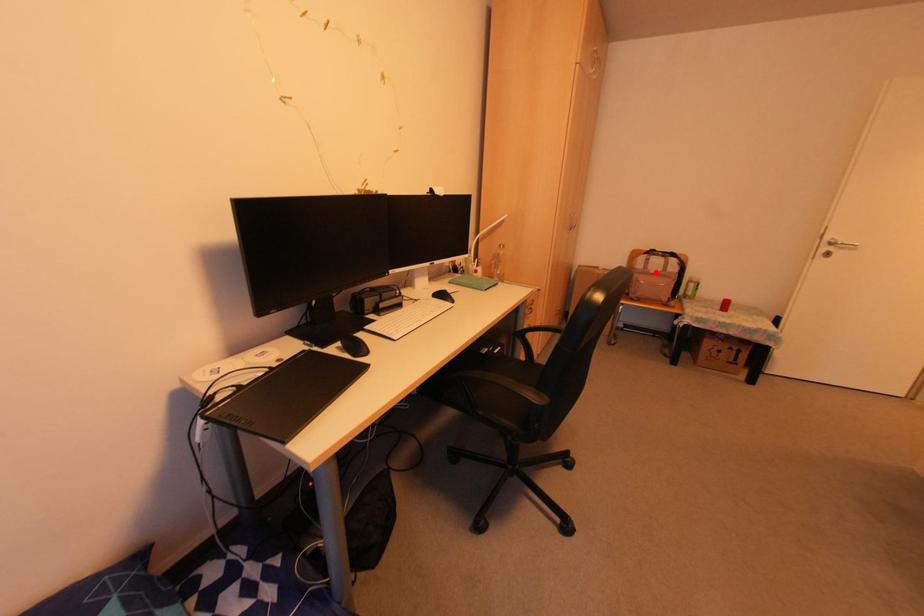
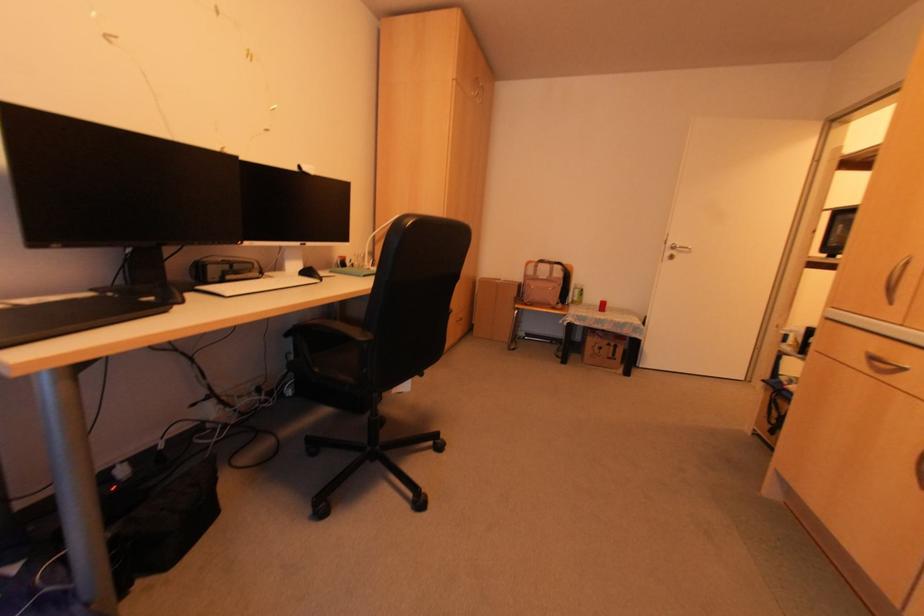
Where in the second image is the point corresponding to the highlighted location from the first image?

(542, 278)